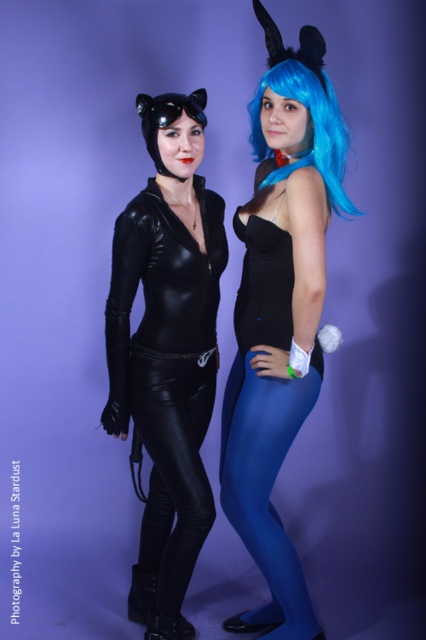
Does blue matte wig at upper right appear over blue matte tights at lower center?

Yes, blue matte wig at upper right is above blue matte tights at lower center.

Looking at this image, who is lower down, blue matte wig at upper right or blue matte tights at lower center?

blue matte tights at lower center is lower down.

Between point (314, 128) and point (238, 518), which one is positioned behind?

The point (238, 518) is behind.

The image size is (426, 640). I want to click on blue matte wig at upper right, so click(279, 310).

Between point (141, 237) and point (152, 483), which one is positioned in front?

Point (141, 237) is more forward.

Find the location of a particular element. The width and height of the screenshot is (426, 640). matte black bodysuit at center is located at coordinates (167, 352).

Does blue matte wig at upper right have a lesser width compared to black leather pants at lower center?

Incorrect, blue matte wig at upper right's width is not less than black leather pants at lower center's.

Which is more to the right, blue matte wig at upper right or black leather pants at lower center?

blue matte wig at upper right

Which is in front, point (259, 116) or point (152, 509)?

Point (259, 116) is in front.

Find the location of a particular element. The width and height of the screenshot is (426, 640). blue matte wig at upper right is located at coordinates (279, 310).